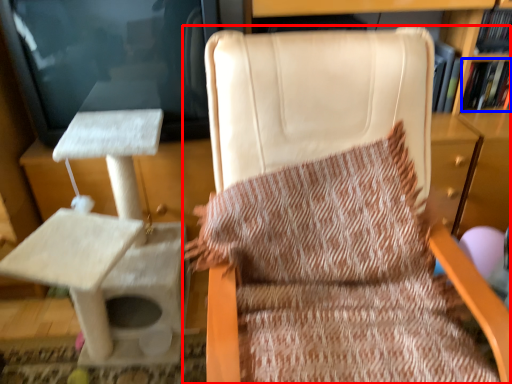
Question: Which of the following is the closest to the observer, chair (highlighted by a red box) or book (highlighted by a blue box)?

Choices:
 (A) chair
 (B) book

Answer: (A)